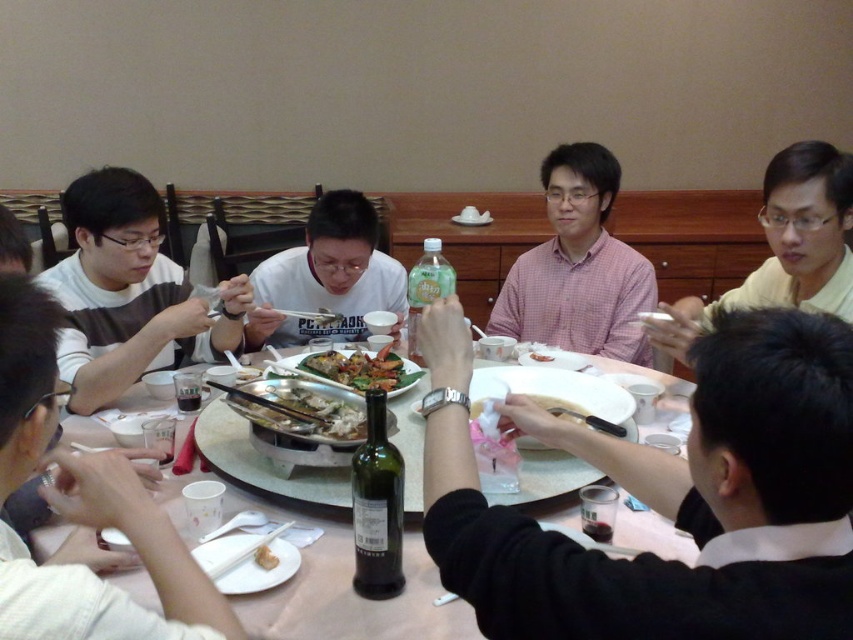
You are a server at a restaurant and need to place a new order of appetizers on the table. The appetizers come in a rectangular tray that is 20 cm wide. The table has limited space. Considering the white striped sweater at left and the wooden chopsticks at center, which object should you avoid placing the tray near to ensure it fits?

You should avoid placing the tray near the white striped sweater at left because it might be wider than the wooden chopsticks at center, and the 20 cm wide tray may not fit there.

You are a photographer standing near the camera. You want to take a photo of the black matte shirt at center without any obstructions. Can you do that?

The black matte shirt at center and camera are 23.69 inches apart, so yes, you can take a photo of the black matte shirt at center without any obstructions since there is enough distance between them.

You are a photographer trying to capture the pink checkered shirt at center and the green leafy vegetables at center in the same frame. Since both are at the center, which one is closer to the camera?

The pink checkered shirt at center is closer to the camera than the green leafy vegetables at center because the green leafy vegetables at center is behind the pink checkered shirt at center.